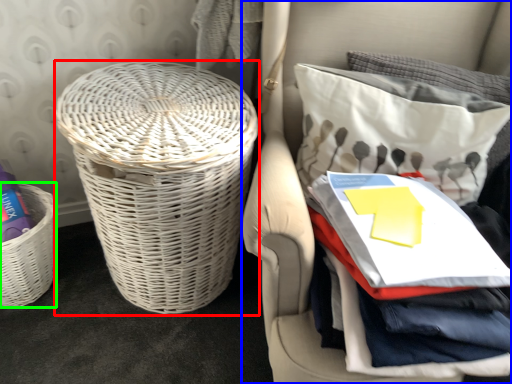
Question: Which object is positioned farthest from basket (highlighted by a red box)? Select from furniture (highlighted by a blue box) and basket (highlighted by a green box).

Choices:
 (A) furniture
 (B) basket

Answer: (B)